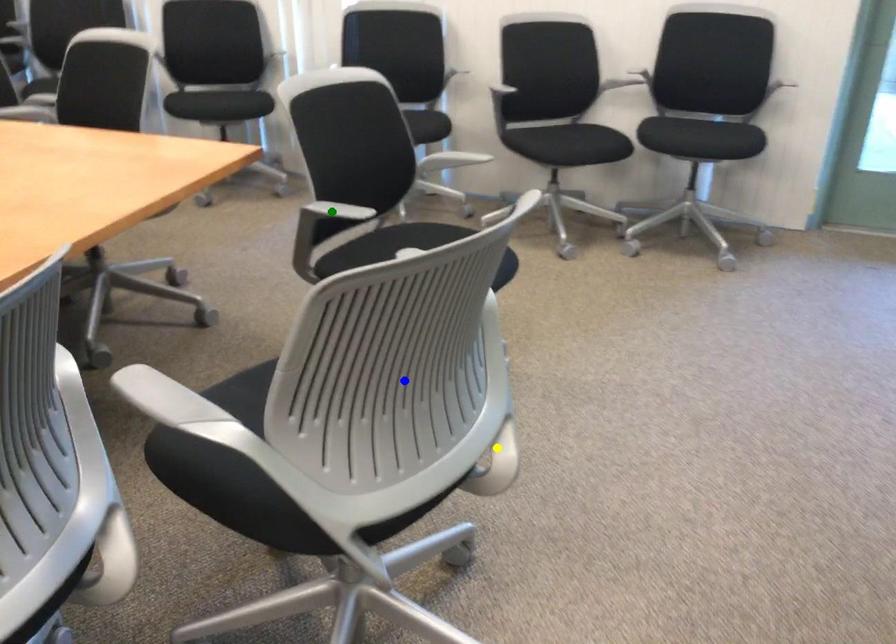
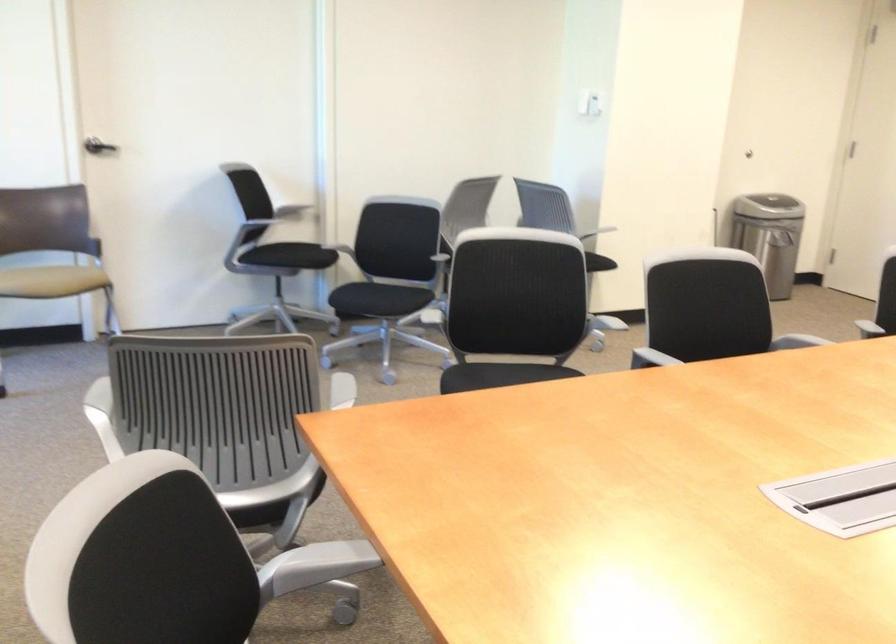
I am providing you with two images of the same scene from different viewpoints. Three points are marked in image1. Which point corresponds to a part or object that is occluded in image2?In image1, three points are marked. Which of them correspond to a part or object that is occluded in image2?Among the three points shown in image1, which one corresponds to a part or object that is no longer visible due to occlusion in image2?

Invisible in image2: green point, yellow point.